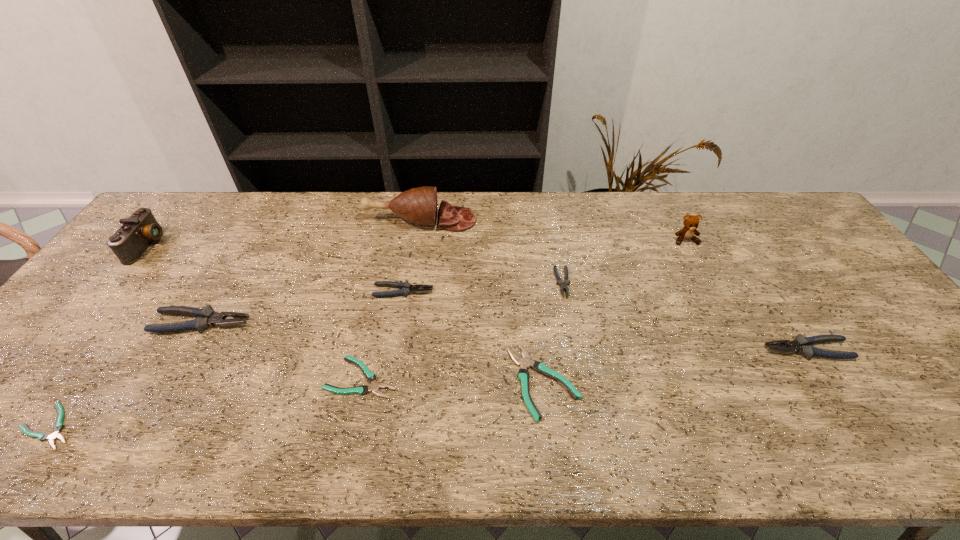
Locate an element on the screen. teddy bear that is at the far edge is located at coordinates (690, 223).

Find the location of a particular element. Image resolution: width=960 pixels, height=540 pixels. camera situated at the far edge is located at coordinates (132, 239).

This screenshot has height=540, width=960. Find the location of `camera present at the left edge`. camera present at the left edge is located at coordinates (132, 239).

What are the coordinates of `pliers that is positioned at the left edge` in the screenshot? It's located at (58, 426).

You are a GUI agent. You are given a task and a screenshot of the screen. Output one action in this format:
    pyautogui.click(x=<x>, y=<y>)
    Task: Click on the object at the far left corner
    The width and height of the screenshot is (960, 540).
    Given the screenshot: What is the action you would take?
    pyautogui.click(x=132, y=239)

At what (x,y) coordinates should I click in order to perform the action: click on object that is at the near left corner. Please return your answer as a coordinate pair (x, y). Looking at the image, I should click on (58, 426).

Where is `free spot at the far edge of the desktop`? This screenshot has width=960, height=540. free spot at the far edge of the desktop is located at coordinates (285, 200).

Identify the location of vacant point at the near edge. (101, 454).

Locate an element on the screen. vacant space at the left edge of the desktop is located at coordinates (139, 301).

Locate an element on the screen. This screenshot has width=960, height=540. vacant space at the far left corner of the desktop is located at coordinates (180, 232).